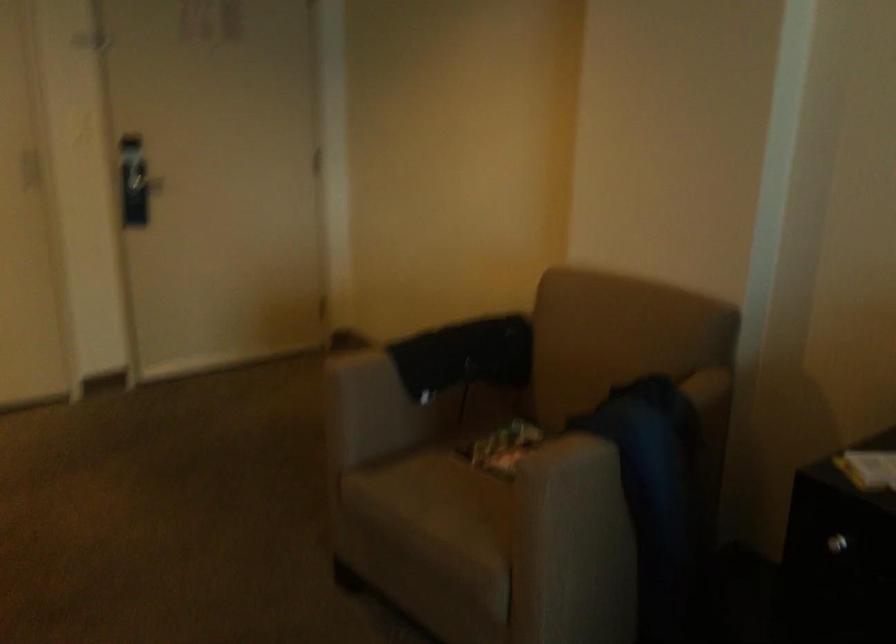
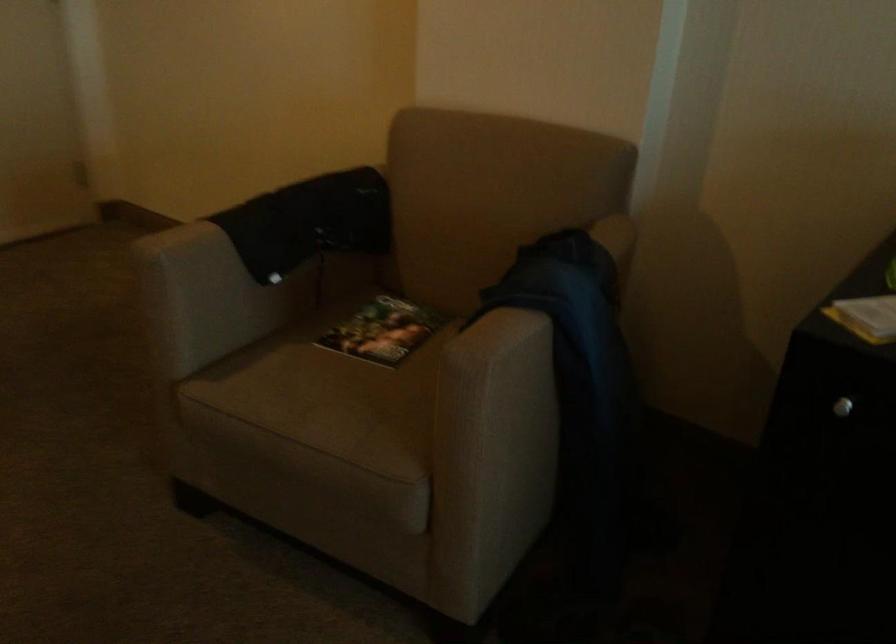
The point at (371, 368) is marked in the first image. Where is the corresponding point in the second image?

(201, 243)